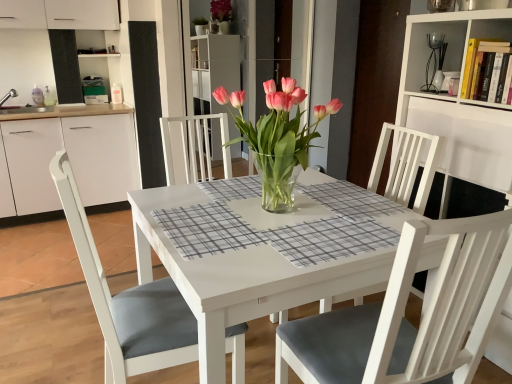
Locate an element on the screen. vacant space underneath pink glass vase at center (from a real-world perspective) is located at coordinates (278, 210).